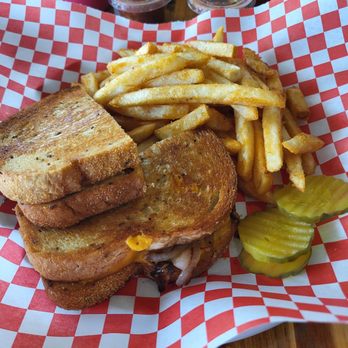
Where is `crumb`? The image size is (348, 348). crumb is located at coordinates (238, 211), (221, 249).